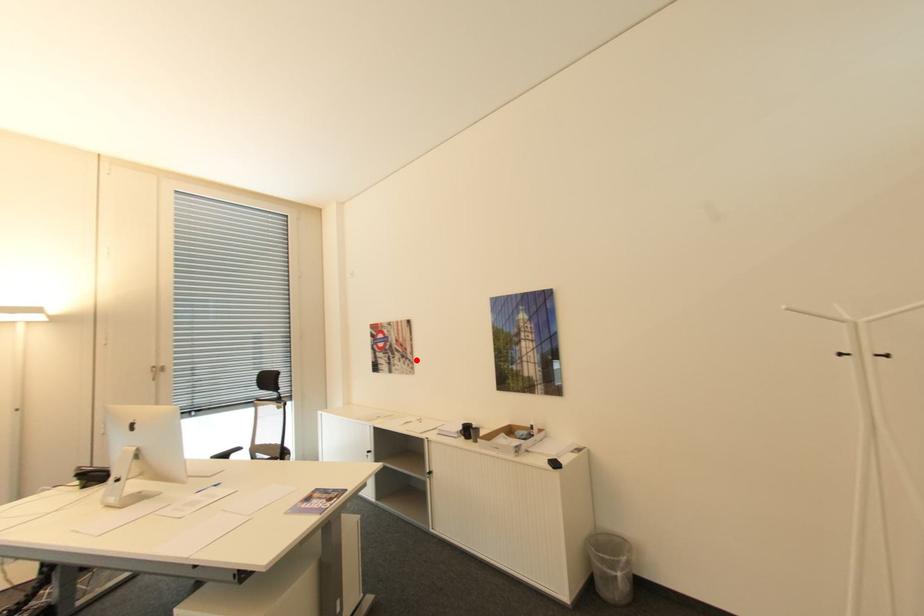
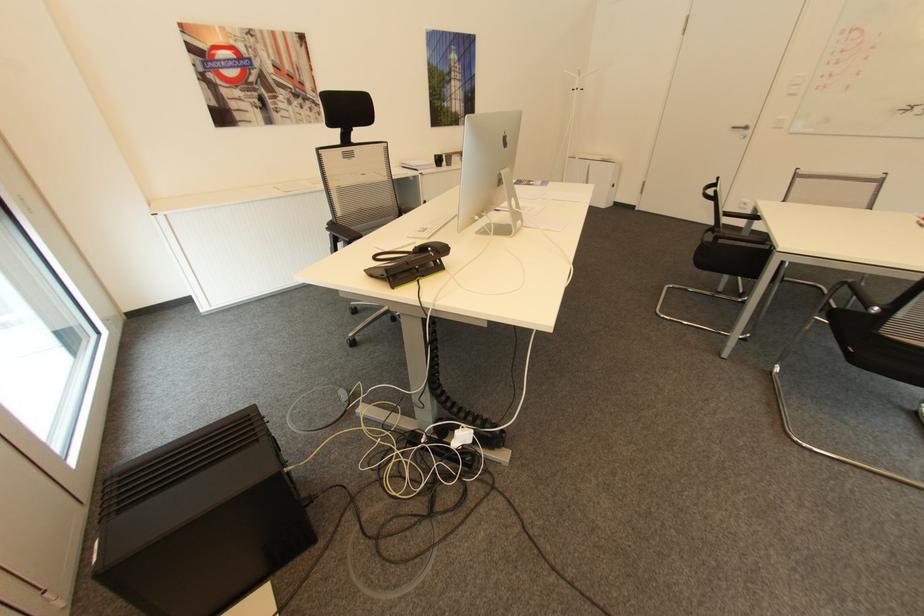
Question: A red point is marked in image1. In image2, is the corresponding 3D point closer to the camera or farther? Reply with the corresponding letter.

Choices:
 (A) The corresponding 3D point is closer.
 (B) The corresponding 3D point is farther.

Answer: (A)